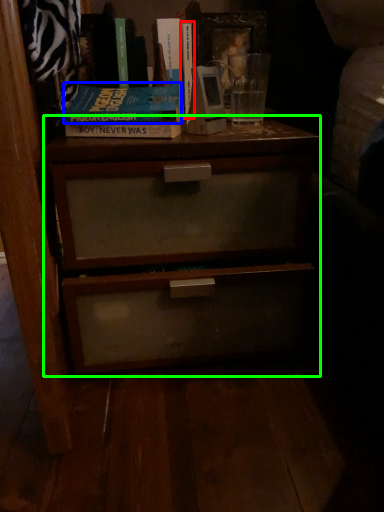
Question: Which object is the farthest from book (highlighted by a red box)? Choose among these: paperback book (highlighted by a blue box) or nightstand (highlighted by a green box).

Choices:
 (A) paperback book
 (B) nightstand

Answer: (B)